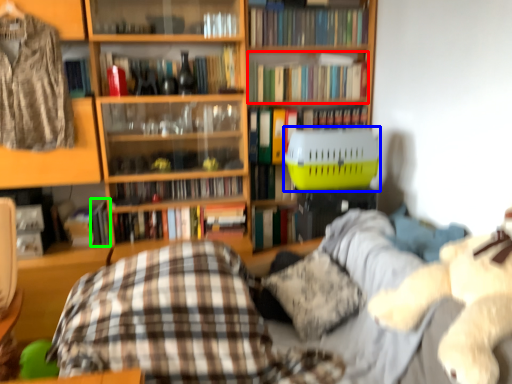
Question: Which is nearer to the book (highlighted by a red box)? basket (highlighted by a blue box) or book (highlighted by a green box).

Choices:
 (A) basket
 (B) book

Answer: (A)